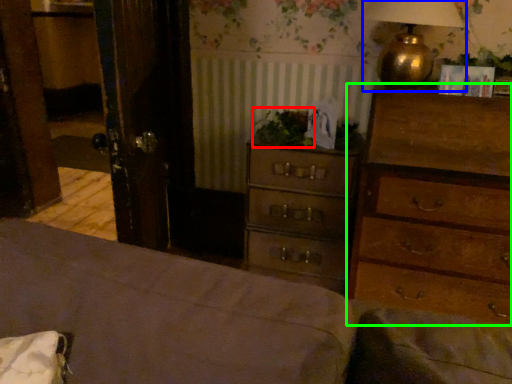
Question: Which is nearer to the plant (highlighted by a red box)? table lamp (highlighted by a blue box) or chest of drawers (highlighted by a green box).

Choices:
 (A) table lamp
 (B) chest of drawers

Answer: (A)